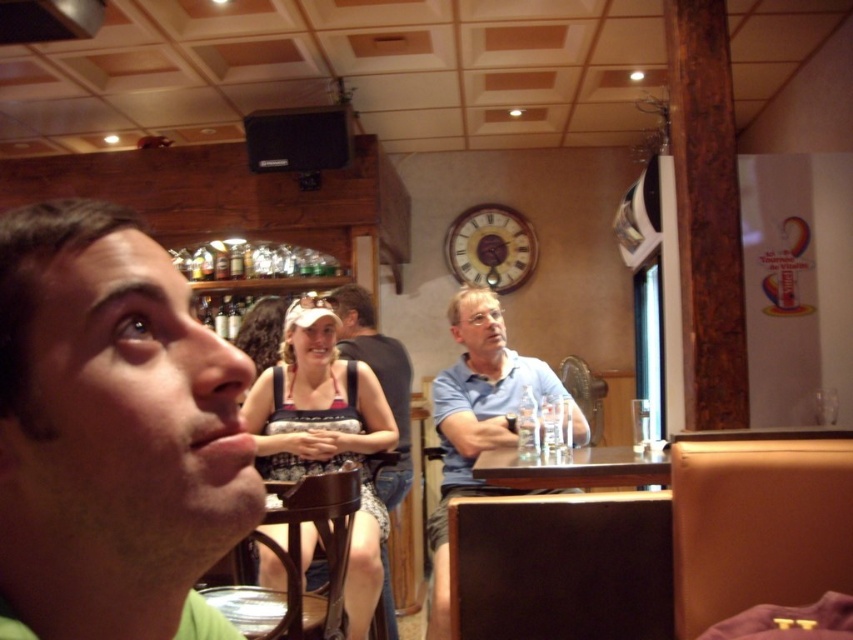
You are a customer in the cafe and want to point out the green matte shirt at left to a friend. Which shirt is located above the blue cotton shirt at center?

The green matte shirt at left is positioned over the blue cotton shirt at center.

You are standing at the entrance of the cafe and want to find the man wearing the green matte shirt at left. According to the coordinates given, where should you look to find him?

The green matte shirt at left is located at coordinates point (111,433), so you should look towards the lower right area of the image to find him.

You are taking a photo of the scene and want to focus on both the point at (477, 428) and the point at (387, 344). Which point should you adjust your focus to first to ensure the closer one is sharp?

You should focus on point (477, 428) first because it is closer to the camera than point (387, 344).